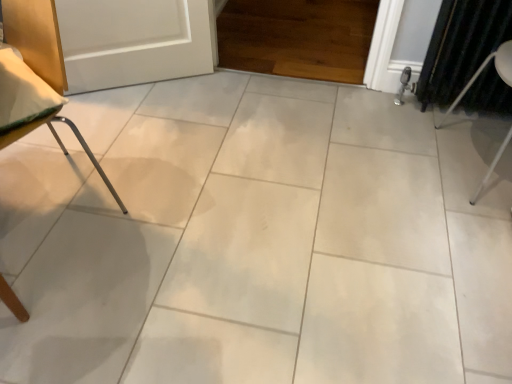
Question: Does dark green fabric curtain at right have a greater width compared to metallic silver chair leg at left, marked as the 1th furniture in a left-to-right arrangement?

Choices:
 (A) yes
 (B) no

Answer: (B)

Question: From a real-world perspective, is dark green fabric curtain at right positioned under metallic silver chair leg at left, positioned as the second furniture in right-to-left order, based on gravity?

Choices:
 (A) no
 (B) yes

Answer: (B)

Question: Is dark green fabric curtain at right shorter than metallic silver chair leg at left, marked as the 1th furniture in a left-to-right arrangement?

Choices:
 (A) yes
 (B) no

Answer: (A)

Question: Is dark green fabric curtain at right to the right of metallic silver chair leg at left, marked as the 1th furniture in a left-to-right arrangement, from the viewer's perspective?

Choices:
 (A) yes
 (B) no

Answer: (A)

Question: Is the position of dark green fabric curtain at right less distant than that of metallic silver chair leg at left, marked as the 1th furniture in a left-to-right arrangement?

Choices:
 (A) yes
 (B) no

Answer: (B)

Question: Is dark green fabric curtain at right next to metallic silver chair leg at left, marked as the 1th furniture in a left-to-right arrangement?

Choices:
 (A) no
 (B) yes

Answer: (A)

Question: From the image's perspective, does white metal chair at right, the second furniture viewed from the left, appear higher than metallic silver chair leg at left, marked as the 1th furniture in a left-to-right arrangement?

Choices:
 (A) yes
 (B) no

Answer: (A)

Question: Is white metal chair at right, the second furniture viewed from the left, smaller than metallic silver chair leg at left, marked as the 1th furniture in a left-to-right arrangement?

Choices:
 (A) no
 (B) yes

Answer: (B)

Question: Could you tell me if white metal chair at right, the second furniture viewed from the left, is facing metallic silver chair leg at left, positioned as the second furniture in right-to-left order?

Choices:
 (A) no
 (B) yes

Answer: (B)

Question: Would you say white metal chair at right, the second furniture viewed from the left, contains metallic silver chair leg at left, marked as the 1th furniture in a left-to-right arrangement?

Choices:
 (A) yes
 (B) no

Answer: (B)

Question: Considering the relative sizes of white metal chair at right, the first furniture positioned from the right, and metallic silver chair leg at left, positioned as the second furniture in right-to-left order, in the image provided, is white metal chair at right, the first furniture positioned from the right, bigger than metallic silver chair leg at left, positioned as the second furniture in right-to-left order,?

Choices:
 (A) no
 (B) yes

Answer: (A)

Question: Is white metal chair at right, the second furniture viewed from the left, at the right side of metallic silver chair leg at left, marked as the 1th furniture in a left-to-right arrangement?

Choices:
 (A) no
 (B) yes

Answer: (B)

Question: Is white metal chair at right, the first furniture positioned from the right, outside of dark green fabric curtain at right?

Choices:
 (A) yes
 (B) no

Answer: (A)